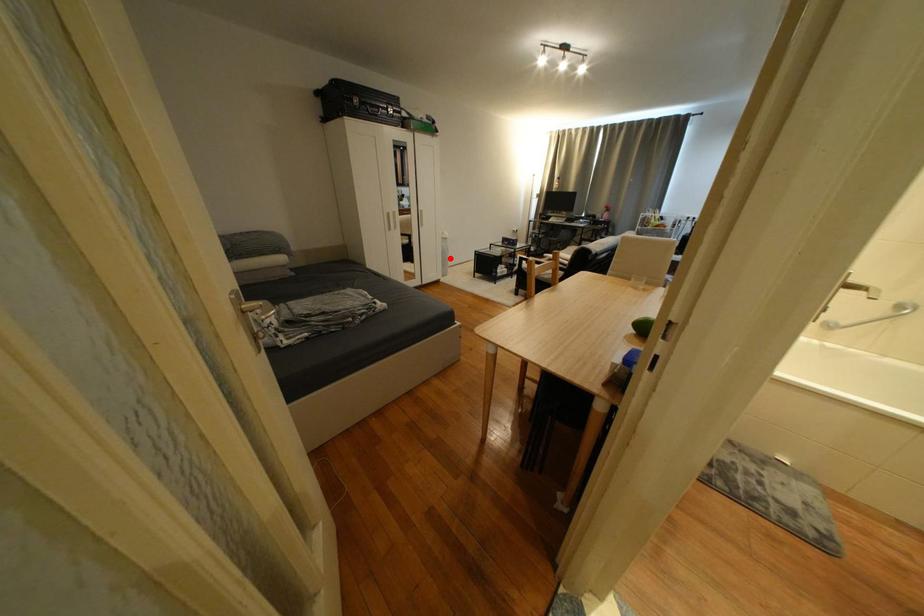
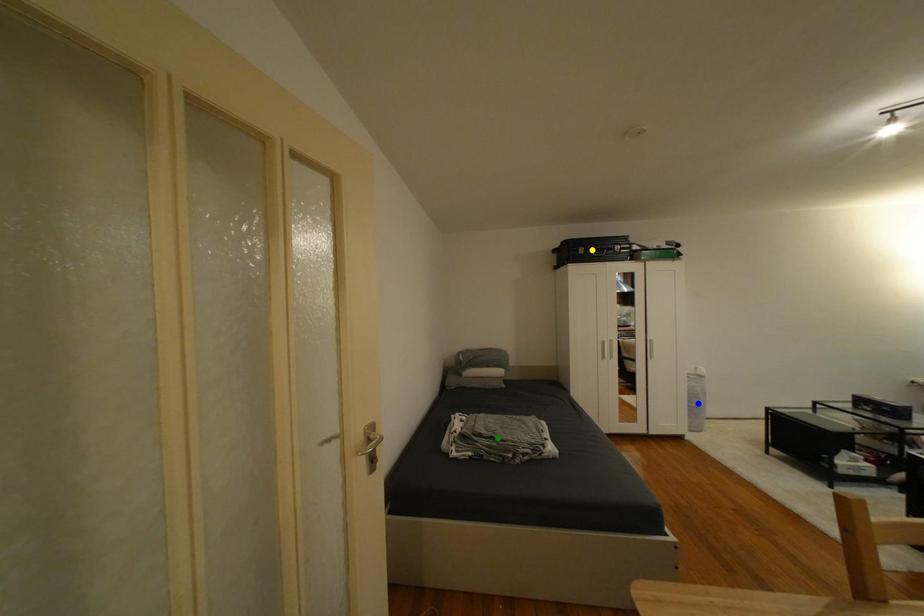
Question: I am providing you with two images of the same scene from different viewpoints. A red point is marked on the first image. You are given multiple points on the second image. Which point in image 2 represents the same 3d spot as the red point in image 1?

Choices:
 (A) yellow point
 (B) green point
 (C) blue point

Answer: (C)